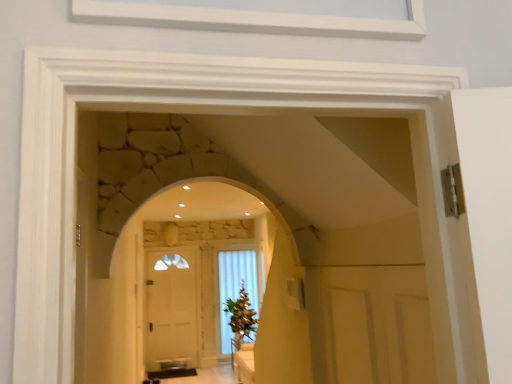
The width and height of the screenshot is (512, 384). Describe the element at coordinates (370, 325) in the screenshot. I see `white wood door at right` at that location.

Find the location of a particular element. The width and height of the screenshot is (512, 384). white wood door at right is located at coordinates (370, 325).

The image size is (512, 384). Find the location of `white wood door at right`. white wood door at right is located at coordinates (370, 325).